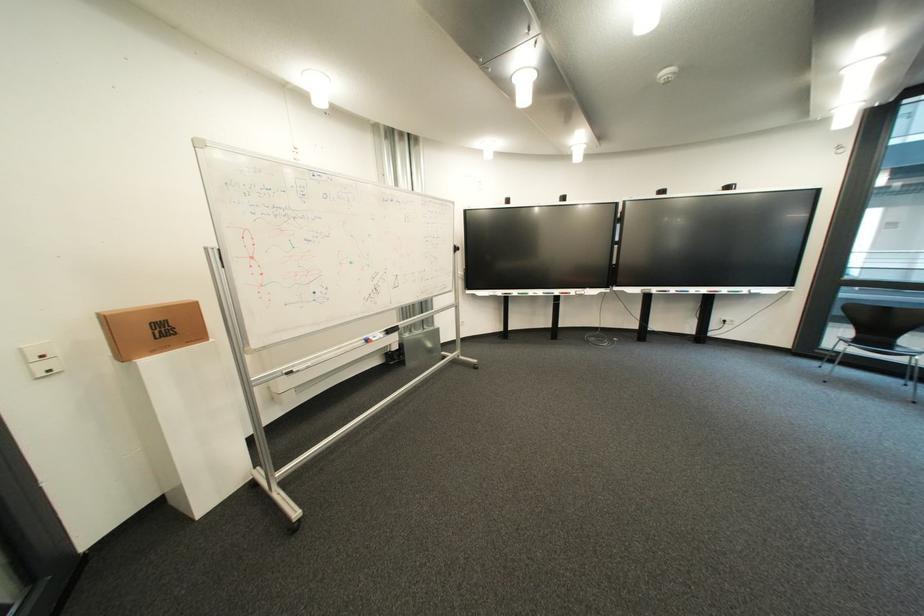
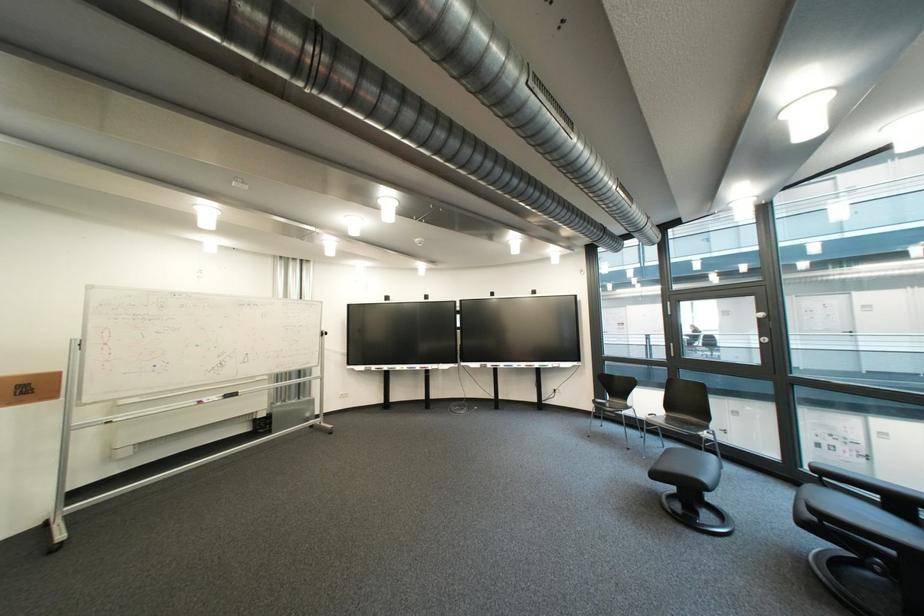
In a continuous first-person perspective shot, in which direction is the camera moving?

The cameraman moved toward right, backward.